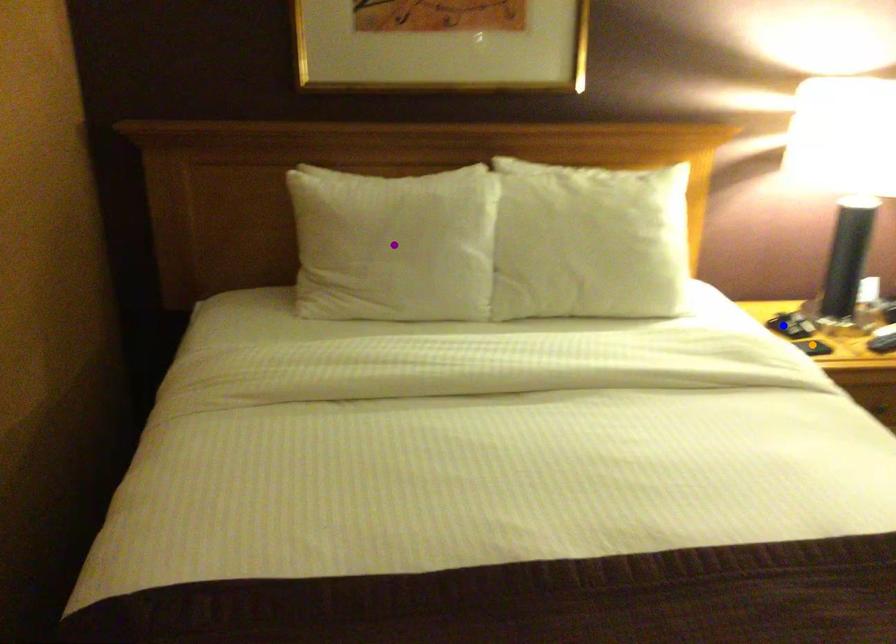
Order these from farthest to nearest:
purple point | blue point | orange point

blue point → orange point → purple point